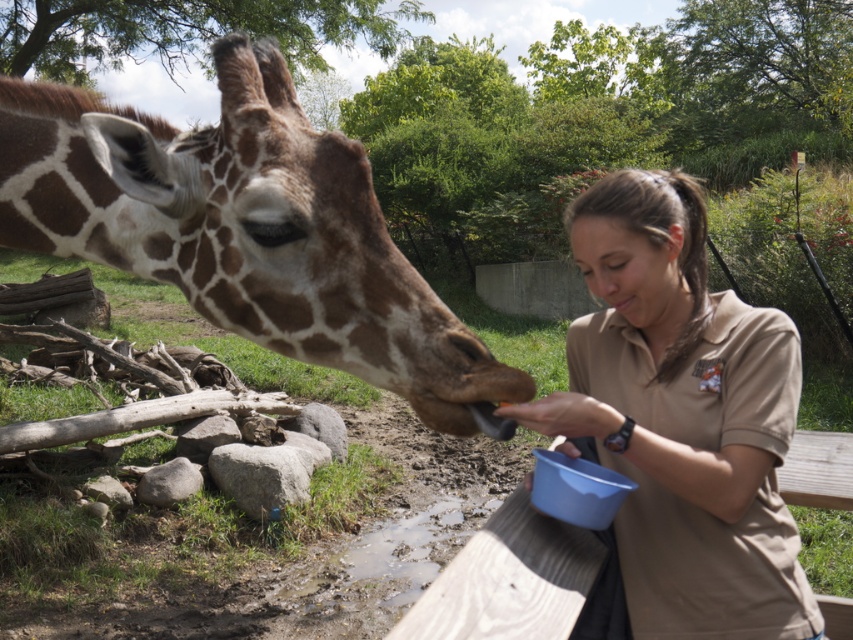
Who is more forward, (344, 268) or (746, 444)?

Point (344, 268) is more forward.

Where is `brown spotted skin at center`? The width and height of the screenshot is (853, 640). brown spotted skin at center is located at coordinates (247, 228).